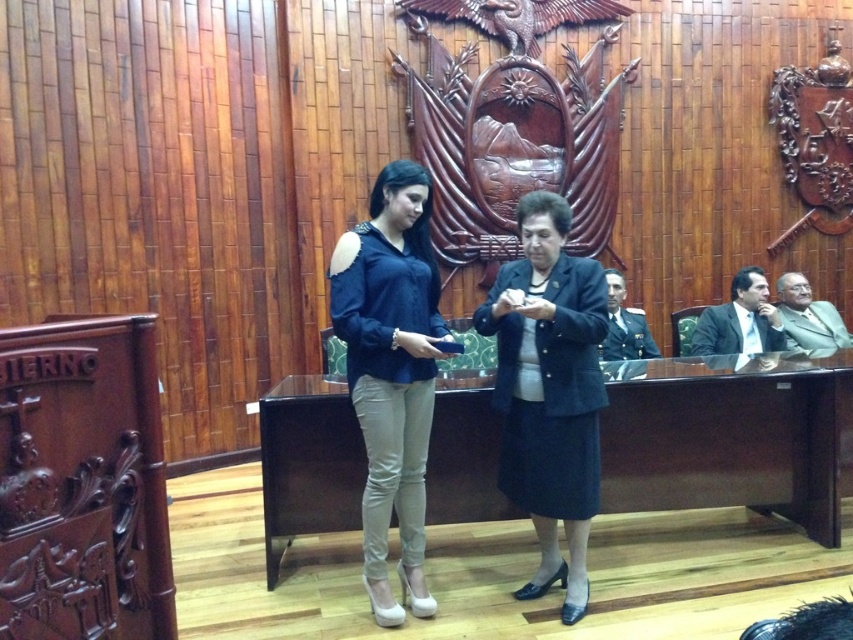
Which is below, matte black suit at right or dark green uniform at right?

dark green uniform at right is lower down.

What are the coordinates of `matte black suit at right` in the screenshot? It's located at pyautogui.click(x=740, y=320).

Where is `matte black suit at right`? matte black suit at right is located at coordinates (740, 320).

Who is positioned more to the left, matte blue blouse at center or dark green uniform at right?

Positioned to the left is matte blue blouse at center.

Is matte blue blouse at center to the right of dark green uniform at right from the viewer's perspective?

No, matte blue blouse at center is not to the right of dark green uniform at right.

Who is more distant from viewer, (422, 364) or (634, 321)?

The point (634, 321) is more distant.

Identify the location of matte blue blouse at center. (392, 371).

In order to click on brown wood table at center in this screenshot , I will do `click(730, 436)`.

Between point (836, 522) and point (537, 333), which one is positioned in front?

Point (537, 333) is more forward.

Where is `brown wood table at center`? brown wood table at center is located at coordinates (730, 436).